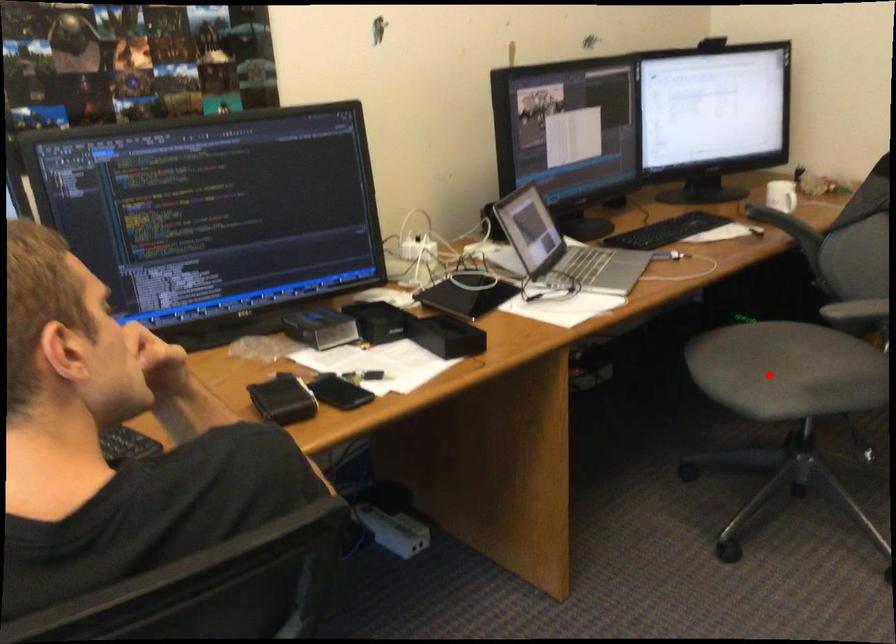
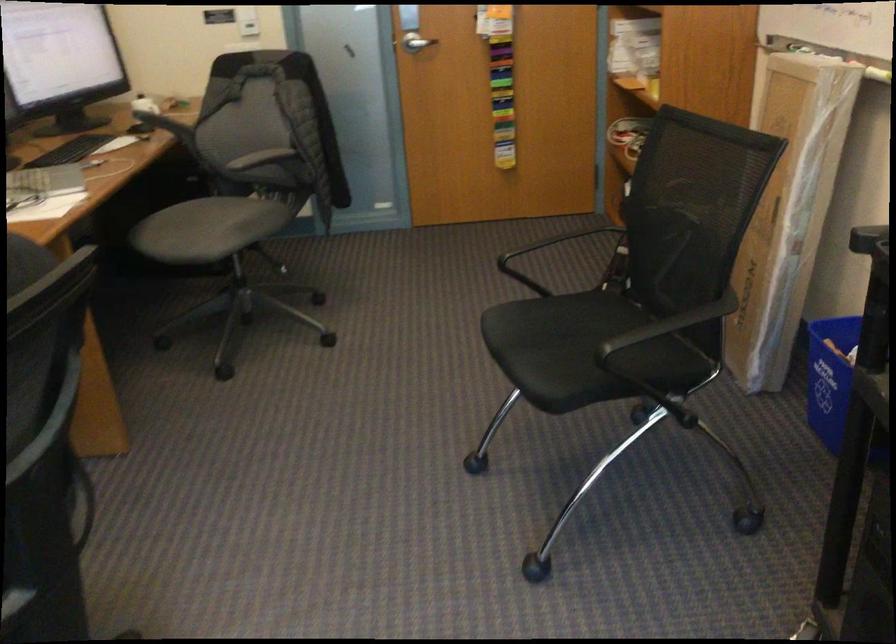
Question: I am providing you with two images of the same scene from different viewpoints. A red point is shown in image1. For the corresponding object point in image2, is it positioned nearer or farther from the camera?

Choices:
 (A) Nearer
 (B) Farther

Answer: (B)